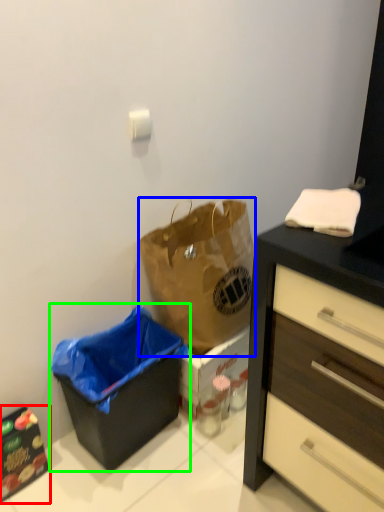
Question: Which is farther away from cabinetry (highlighted by a red box)? handbag (highlighted by a blue box) or recycling bin (highlighted by a green box)?

Choices:
 (A) handbag
 (B) recycling bin

Answer: (A)